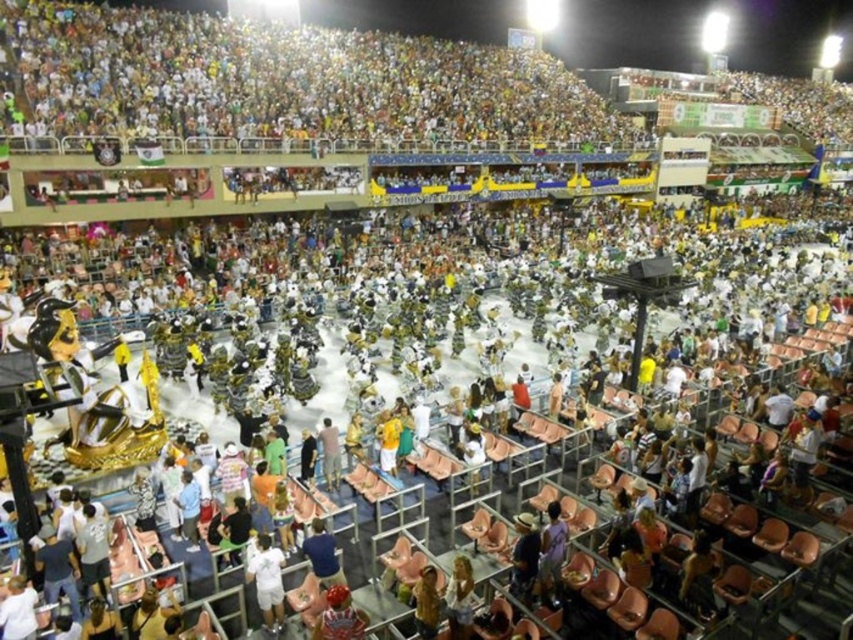
Does white matte shirt at lower center appear over light brown leather jacket at center?

Incorrect, white matte shirt at lower center is not positioned above light brown leather jacket at center.

Which is in front, point (267, 548) or point (328, 435)?

Point (267, 548) is more forward.

Find the location of a particular element. The image size is (853, 640). white matte shirt at lower center is located at coordinates (267, 580).